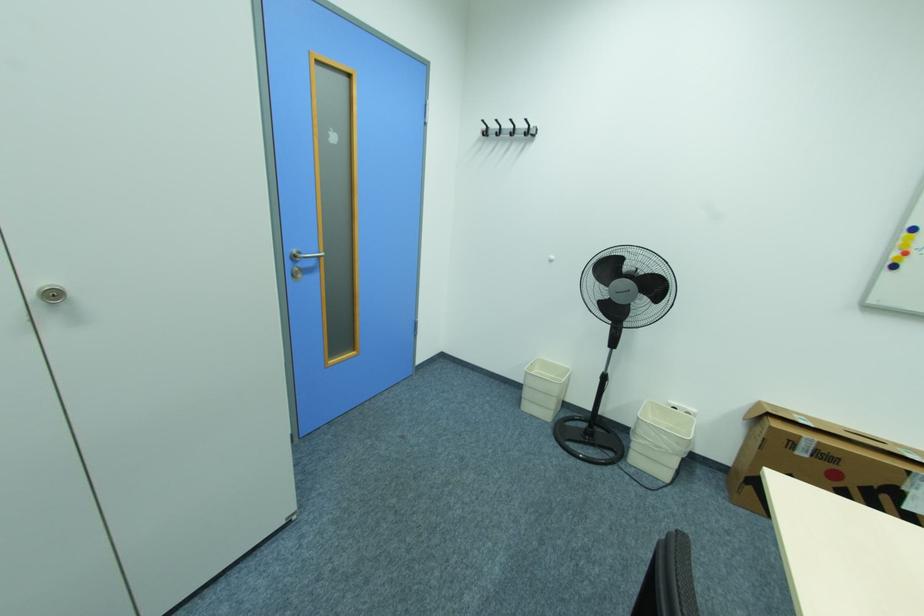
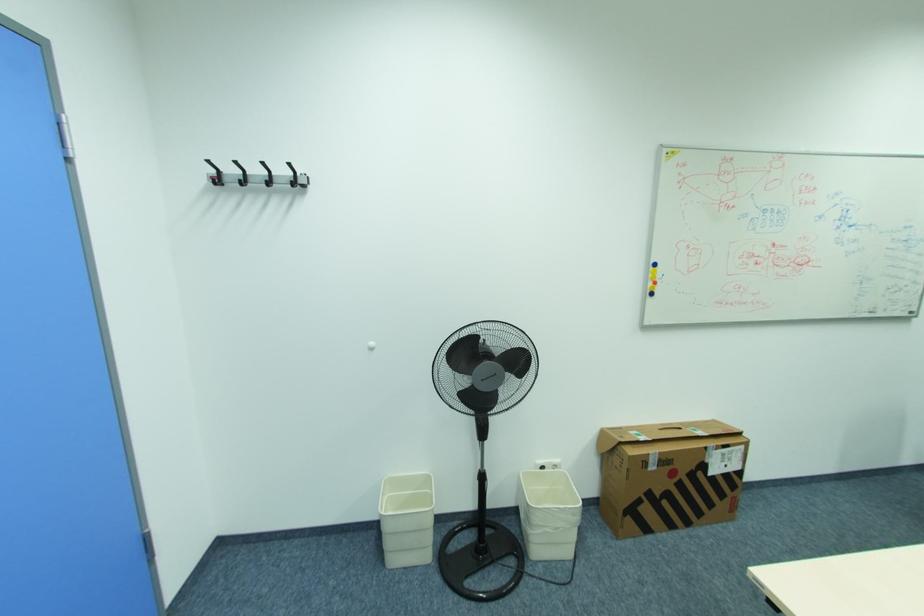
Question: The first image is from the beginning of the video and the second image is from the end. How did the camera likely rotate when shooting the video?

Choices:
 (A) Left
 (B) Right
 (C) Up
 (D) Down

Answer: (B)